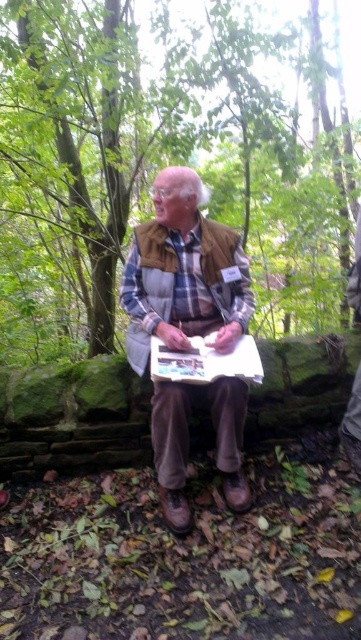
Question: Among these points, which one is nearest to the camera?

Choices:
 (A) (109, 148)
 (B) (231, 236)

Answer: (B)

Question: Considering the relative positions of brown suede vest at center and white paper clipboard at center in the image provided, where is brown suede vest at center located with respect to white paper clipboard at center?

Choices:
 (A) below
 (B) above

Answer: (B)

Question: Which object is closer to the camera taking this photo?

Choices:
 (A) white paper clipboard at center
 (B) brown suede vest at center
 (C) green leafy tree at center

Answer: (A)

Question: Estimate the real-world distances between objects in this image. Which object is farther from the white paper clipboard at center?

Choices:
 (A) brown suede vest at center
 (B) green leafy tree at center

Answer: (B)

Question: Is green leafy tree at center in front of brown suede vest at center?

Choices:
 (A) yes
 (B) no

Answer: (B)

Question: Is brown suede vest at center to the right of white paper clipboard at center from the viewer's perspective?

Choices:
 (A) no
 (B) yes

Answer: (A)